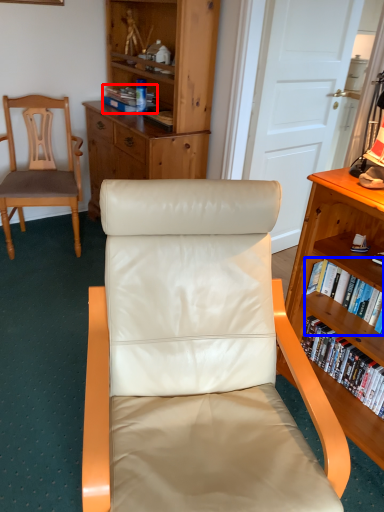
Question: Which point is closer to the camera, book (highlighted by a red box) or book (highlighted by a blue box)?

Choices:
 (A) book
 (B) book

Answer: (B)